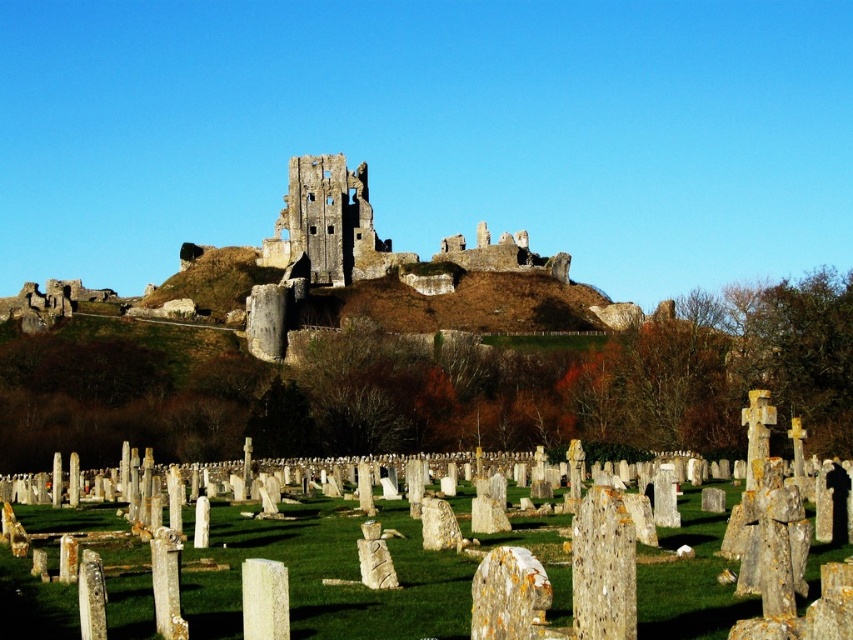
From the picture: Does speckled stone gravestones at center come behind rustic stone castle at center?

No, speckled stone gravestones at center is in front of rustic stone castle at center.

Which of these two, speckled stone gravestones at center or rustic stone castle at center, stands taller?

Standing taller between the two is rustic stone castle at center.

Find the location of a particular element. speckled stone gravestones at center is located at coordinates (403, 580).